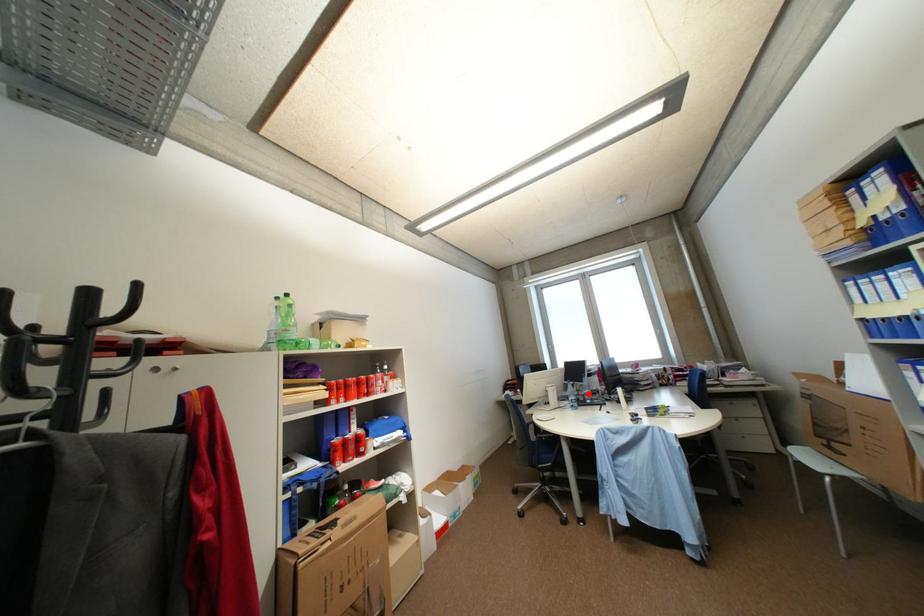
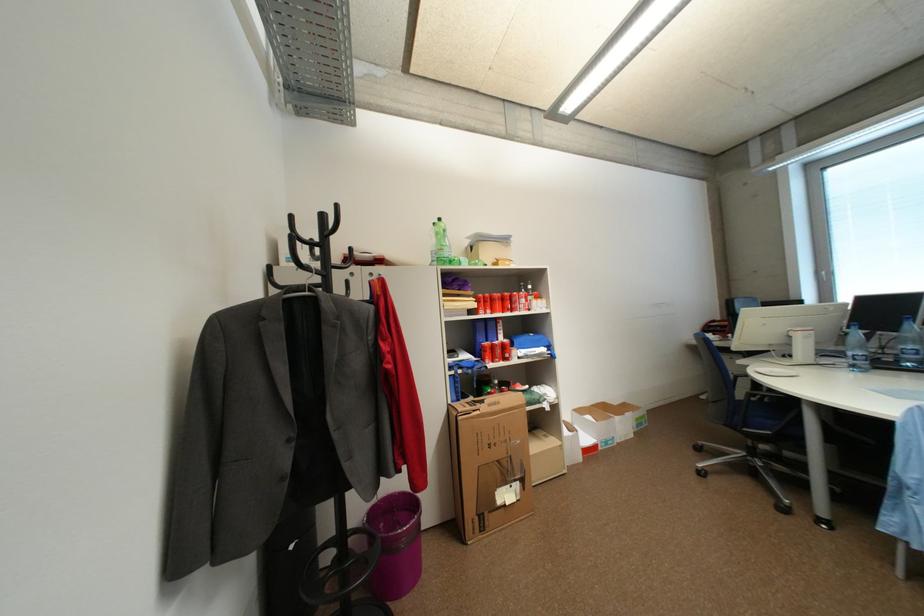
Question: I am providing you with two images of the same scene from different viewpoints. A red point is shown in image1. For the corresponding object point in image2, is it positioned nearer or farther from the camera?

Choices:
 (A) Nearer
 (B) Farther

Answer: (A)